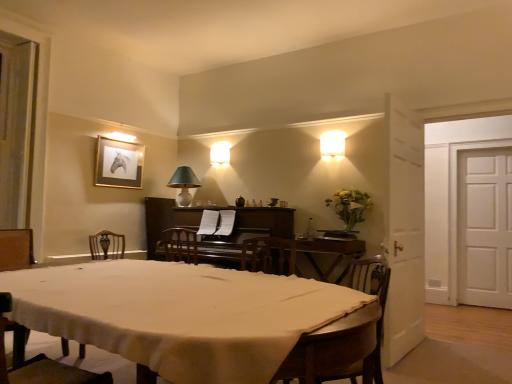
Where is `white cloth-covered table at center`? This screenshot has height=384, width=512. white cloth-covered table at center is located at coordinates (179, 314).

Describe the element at coordinates (332, 145) in the screenshot. I see `matte white lampshade at upper right, arranged as the 1th lamp when viewed from the right` at that location.

Based on the photo, measure the distance between point (330, 133) and camera.

Point (330, 133) and camera are 4.32 meters apart from each other.

Describe the element at coordinates (184, 184) in the screenshot. I see `matte white lampshade at center, the third lamp positioned from the right` at that location.

The image size is (512, 384). What do you see at coordinates (118, 163) in the screenshot? I see `gold metallic picture frame at upper left` at bounding box center [118, 163].

This screenshot has height=384, width=512. Describe the element at coordinates (345, 336) in the screenshot. I see `wooden striped chair at lower right, the 2th chair positioned from the left` at that location.

Identify the location of white cloth-covered table at center. (179, 314).

Considering the sizes of gold metallic picture frame at upper left and dark brown polished wood piano at center in the image, is gold metallic picture frame at upper left wider or thinner than dark brown polished wood piano at center?

Considering their sizes, gold metallic picture frame at upper left looks slimmer than dark brown polished wood piano at center.

Does gold metallic picture frame at upper left contain dark brown polished wood piano at center?

No, dark brown polished wood piano at center is not inside gold metallic picture frame at upper left.

Is gold metallic picture frame at upper left further to camera compared to dark brown polished wood piano at center?

Yes.

Is gold metallic picture frame at upper left placed right next to dark brown polished wood piano at center?

No.

Which is more to the left, matte white lampshade at center, the second lamp in the front-to-back sequence, or white matte door at right?

matte white lampshade at center, the second lamp in the front-to-back sequence.

Who is smaller, matte white lampshade at center, the second lamp in the front-to-back sequence, or white matte door at right?

matte white lampshade at center, the second lamp in the front-to-back sequence, is smaller.

Considering the positions of point (189, 197) and point (460, 158), is point (189, 197) closer or farther from the camera than point (460, 158)?

Point (189, 197) is closer to the camera than point (460, 158).

Looking at this image, is matte white lampshade at center, the 2th lamp viewed from the back, looking in the opposite direction of white matte door at right?

matte white lampshade at center, the 2th lamp viewed from the back, does not have its back to white matte door at right.

Is matte white lampshade at center, the second lamp in the front-to-back sequence, completely or partially inside gold metallic picture frame at upper left?

No, matte white lampshade at center, the second lamp in the front-to-back sequence, is located outside of gold metallic picture frame at upper left.

Does gold metallic picture frame at upper left have a lesser width compared to matte white lampshade at center, the 1th lamp viewed from the left?

Indeed, gold metallic picture frame at upper left has a lesser width compared to matte white lampshade at center, the 1th lamp viewed from the left.

From their relative heights in the image, would you say gold metallic picture frame at upper left is taller or shorter than matte white lampshade at center, the 1th lamp viewed from the left?

Considering their sizes, gold metallic picture frame at upper left has more height than matte white lampshade at center, the 1th lamp viewed from the left.

From the image's perspective, which is above, matte white lampshade at upper right, the third lamp from the back, or dark brown polished wood piano at center?

matte white lampshade at upper right, the third lamp from the back.

Locate an element on the screen. The height and width of the screenshot is (384, 512). the 1st lamp behind the dark brown polished wood piano at center is located at coordinates (332, 145).

Could you tell me if clear glass bottle at center is facing dark brown polished wood piano at center?

No, clear glass bottle at center is not facing towards dark brown polished wood piano at center.

Can you confirm if clear glass bottle at center is wider than dark brown polished wood piano at center?

Incorrect, the width of clear glass bottle at center does not surpass that of dark brown polished wood piano at center.

Considering the relative sizes of clear glass bottle at center and dark brown polished wood piano at center in the image provided, is clear glass bottle at center bigger than dark brown polished wood piano at center?

No.

Is clear glass bottle at center directly adjacent to dark brown polished wood piano at center?

clear glass bottle at center is not next to dark brown polished wood piano at center, and they're not touching.

Is matte white lampshade at center, the 1th lamp viewed from the left, to the right of white cloth-covered table at center from the viewer's perspective?

In fact, matte white lampshade at center, the 1th lamp viewed from the left, is to the left of white cloth-covered table at center.

How many degrees apart are the facing directions of matte white lampshade at center, the third lamp positioned from the right, and white cloth-covered table at center?

A: The facing directions of matte white lampshade at center, the third lamp positioned from the right, and white cloth-covered table at center are 1.13 degrees apart.

Consider the image. Considering the relative sizes of matte white lampshade at center, the 2th lamp viewed from the back, and white cloth-covered table at center in the image provided, is matte white lampshade at center, the 2th lamp viewed from the back, wider than white cloth-covered table at center?

No.

Is there a large distance between matte white lampshade at center, the second lamp in the front-to-back sequence, and white cloth-covered table at center?

Yes.

Does matte white lampshade at upper right, arranged as the 1th lamp when viewed from the right, appear on the right side of wooden striped chair at lower right, the 2th chair positioned from the left?

Indeed, matte white lampshade at upper right, arranged as the 1th lamp when viewed from the right, is positioned on the right side of wooden striped chair at lower right, the 2th chair positioned from the left.

From the image's perspective, which chair is the 2nd one below the matte white lampshade at upper right, arranged as the 1th lamp when viewed from the right? Please provide its 2D coordinates.

[(345, 336)]

Is matte white lampshade at upper right, which appears as the 3th lamp when viewed from the left, facing towards wooden striped chair at lower right, which is the second chair in front-to-back order?

No.

Considering the relative sizes of matte white lampshade at upper right, arranged as the 1th lamp when viewed from the right, and wooden striped chair at lower right, the 1th chair from the back, in the image provided, is matte white lampshade at upper right, arranged as the 1th lamp when viewed from the right, bigger than wooden striped chair at lower right, the 1th chair from the back,?

No, matte white lampshade at upper right, arranged as the 1th lamp when viewed from the right, is not bigger than wooden striped chair at lower right, the 1th chair from the back.

This screenshot has height=384, width=512. I want to click on picture frame behind the dark brown polished wood piano at center, so click(118, 163).

Starting from the white matte door at right, which lamp is the 2nd one in front? Please provide its 2D coordinates.

[(184, 184)]

Looking at the image, which one is located further to matte green lampshade at upper center, which is the 1th lamp in back-to-front order, wooden striped chair at lower right, the 1th chair from the back, or dark brown polished wood piano at center?

The object further to matte green lampshade at upper center, which is the 1th lamp in back-to-front order, is wooden striped chair at lower right, the 1th chair from the back.

From the image, which object appears to be nearer to clear glass bottle at center, gold metallic picture frame at upper left or matte green lampshade at upper center, which ranks as the 3th lamp in front-to-back order?

matte green lampshade at upper center, which ranks as the 3th lamp in front-to-back order, lies closer to clear glass bottle at center than the other object.

Estimate the real-world distances between objects in this image. Which object is further from wooden striped chair at lower right, which is the second chair in front-to-back order, white cloth-covered table at center or clear glass bottle at center?

Among the two, clear glass bottle at center is located further to wooden striped chair at lower right, which is the second chair in front-to-back order.

Looking at the image, which one is located further to gold metallic picture frame at upper left, dark brown polished wood piano at center or wooden chair at lower left, marked as the second chair in a right-to-left arrangement?

wooden chair at lower left, marked as the second chair in a right-to-left arrangement, is further to gold metallic picture frame at upper left.

Based on their spatial positions, is white matte door at right or white cloth-covered table at center closer to dark brown polished wood piano at center?

Among the two, white cloth-covered table at center is located nearer to dark brown polished wood piano at center.

From the image, which object appears to be nearer to wooden chair at lower left, the second chair viewed from the back, wooden striped chair at lower right, the first chair in the right-to-left sequence, or gold metallic picture frame at upper left?

The object closer to wooden chair at lower left, the second chair viewed from the back, is wooden striped chair at lower right, the first chair in the right-to-left sequence.

Considering their positions, is wooden striped chair at lower right, the first chair in the right-to-left sequence, positioned further to matte green lampshade at upper center, arranged as the second lamp when viewed from the left, than matte white lampshade at upper right, which appears as the 3th lamp when viewed from the left?

The object further to matte green lampshade at upper center, arranged as the second lamp when viewed from the left, is wooden striped chair at lower right, the first chair in the right-to-left sequence.

Considering their positions, is matte white lampshade at center, the 2th lamp viewed from the back, positioned further to gold metallic picture frame at upper left than dark brown polished wood piano at center?

dark brown polished wood piano at center.

Identify the location of piano between matte green lampshade at upper center, the second lamp from the right, and matte white lampshade at upper right, arranged as the 1th lamp when viewed from the right. (255, 226).

Locate an element on the screen. The image size is (512, 384). piano between white cloth-covered table at center and gold metallic picture frame at upper left along the z-axis is located at coordinates (255, 226).

The height and width of the screenshot is (384, 512). In order to click on lamp located between dark brown polished wood piano at center and white matte door at right in the left-right direction in this screenshot , I will do `click(332, 145)`.

This screenshot has height=384, width=512. I want to click on piano between matte white lampshade at center, the third lamp positioned from the right, and white matte door at right, so click(255, 226).